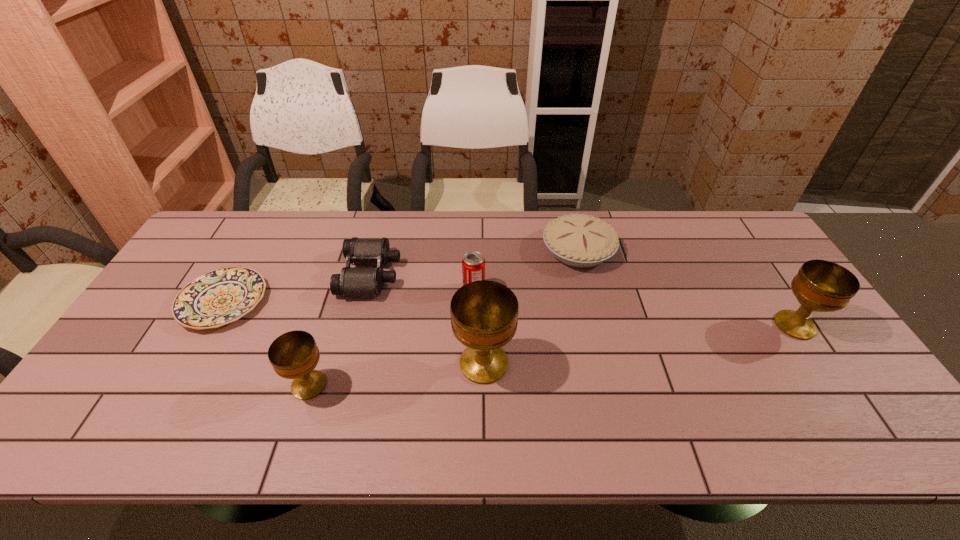
The image size is (960, 540). In order to click on object at the left edge in this screenshot , I will do `click(221, 296)`.

Find the location of a particular element. This screenshot has width=960, height=540. object positioned at the right edge is located at coordinates (822, 286).

This screenshot has width=960, height=540. Find the location of `free space at the far edge`. free space at the far edge is located at coordinates (312, 244).

You are a GUI agent. You are given a task and a screenshot of the screen. Output one action in this format:
    pyautogui.click(x=<x>, y=<y>)
    Task: Click on the free location at the near edge
    
    Given the screenshot: What is the action you would take?
    pyautogui.click(x=500, y=389)

Image resolution: width=960 pixels, height=540 pixels. In the image, there is a desktop. What are the coordinates of `vacant space at the near right corner` in the screenshot? It's located at (876, 407).

Locate an element on the screen. vacant point located between the leftmost chalice and the binoculars is located at coordinates (340, 330).

This screenshot has height=540, width=960. I want to click on unoccupied area between the binoculars and the sixth shortest object, so 583,300.

In order to click on free point between the rightmost object and the leftmost chalice in this screenshot , I will do (x=552, y=355).

I want to click on vacant space in between the sixth object from left to right and the leftmost object, so click(x=401, y=276).

Where is `free space between the leftmost object and the binoculars`? free space between the leftmost object and the binoculars is located at coordinates (297, 288).